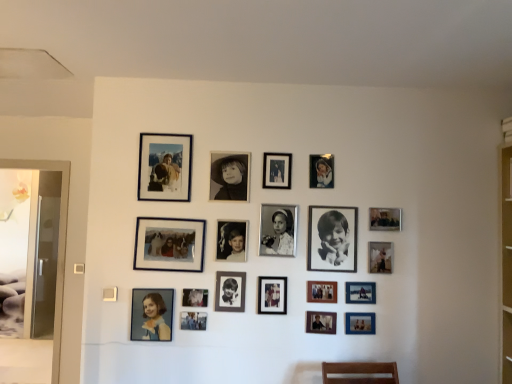
Locate an element on the screen. This screenshot has height=384, width=512. metallic silver photo frame at lower center, which appears as the fourth picture frame when viewed from the left is located at coordinates (193, 320).

In order to click on matte black photo frame at center, which appears as the 16th picture frame when viewed from the right in this screenshot , I will do `click(169, 244)`.

Image resolution: width=512 pixels, height=384 pixels. What do you see at coordinates (231, 241) in the screenshot?
I see `black glossy photo frame at center, which is counted as the eleventh picture frame, starting from the right` at bounding box center [231, 241].

Find the location of a particular element. Image resolution: width=512 pixels, height=384 pixels. black matte photo frame at center, the 6th picture frame viewed from the left is located at coordinates (229, 176).

The height and width of the screenshot is (384, 512). I want to click on matte silver photo frame at center, the fourteenth picture frame when ordered from right to left, so click(x=195, y=298).

Is matte black portrait at lower left, positioned as the first picture frame in left-to-right order, aimed at wooden photo frame at center, the 13th picture frame when ordered from left to right?

No.

Does matte black portrait at lower left, the eighteenth picture frame in the right-to-left sequence, lie in front of wooden photo frame at center, the 13th picture frame when ordered from left to right?

Yes, matte black portrait at lower left, the eighteenth picture frame in the right-to-left sequence, is in front of wooden photo frame at center, the 13th picture frame when ordered from left to right.

Which is more to the left, matte black portrait at lower left, the eighteenth picture frame in the right-to-left sequence, or wooden photo frame at center, the 13th picture frame when ordered from left to right?

matte black portrait at lower left, the eighteenth picture frame in the right-to-left sequence, is more to the left.

Looking at this image, what's the angular difference between matte black portrait at lower left, positioned as the first picture frame in left-to-right order, and wooden photo frame at center, the sixth picture frame when ordered from right to left,'s facing directions?

They differ by 0.011 degrees in their facing directions.

Could you tell me if black glossy photo frame at center, which is counted as the eleventh picture frame, starting from the right, is turned towards metallic silver photo frame at lower center, which appears as the fourth picture frame when viewed from the left?

No, black glossy photo frame at center, which is counted as the eleventh picture frame, starting from the right, does not turn towards metallic silver photo frame at lower center, which appears as the fourth picture frame when viewed from the left.

From a real-world perspective, between black glossy photo frame at center, which is counted as the eleventh picture frame, starting from the right, and metallic silver photo frame at lower center, which appears as the fourth picture frame when viewed from the left, who is vertically lower?

In real-world perspective, metallic silver photo frame at lower center, which appears as the fourth picture frame when viewed from the left, is lower.

Considering the points (245, 222) and (190, 327), which point is behind, point (245, 222) or point (190, 327)?

Positioned behind is point (245, 222).

Is black glossy photo frame at center, the eighth picture frame in the left-to-right sequence, behind metallic silver photo frame at lower center, which appears as the fourth picture frame when viewed from the left?

Yes, the depth of black glossy photo frame at center, the eighth picture frame in the left-to-right sequence, is greater than that of metallic silver photo frame at lower center, which appears as the fourth picture frame when viewed from the left.

Between matte black photo frame at center, which appears as the 16th picture frame when viewed from the right, and matte black portrait at lower left, positioned as the first picture frame in left-to-right order, which one has smaller width?

Thinner between the two is matte black portrait at lower left, positioned as the first picture frame in left-to-right order.

Between matte black photo frame at center, which is the 3th picture frame in left-to-right order, and matte black portrait at lower left, positioned as the first picture frame in left-to-right order, which one appears on the left side from the viewer's perspective?

matte black portrait at lower left, positioned as the first picture frame in left-to-right order, is more to the left.

Does matte black photo frame at center, which is the 3th picture frame in left-to-right order, come in front of matte black portrait at lower left, the eighteenth picture frame in the right-to-left sequence?

That is False.

Consider the image. Considering the sizes of objects matte black photo frame at center, which appears as the 16th picture frame when viewed from the right, and matte black portrait at lower left, positioned as the first picture frame in left-to-right order, in the image provided, who is taller, matte black photo frame at center, which appears as the 16th picture frame when viewed from the right, or matte black portrait at lower left, positioned as the first picture frame in left-to-right order,?

matte black photo frame at center, which appears as the 16th picture frame when viewed from the right.

In the scene shown: Which is more to the left, black matte photo frame at center, marked as the 8th picture frame in a right-to-left arrangement, or black matte photo frame at center, which ranks as the 12th picture frame in right-to-left order?

Positioned to the left is black matte photo frame at center, which ranks as the 12th picture frame in right-to-left order.

Where is `the 4th picture frame counting from the left of the black matte photo frame at center, which is counted as the 11th picture frame, starting from the left`? This screenshot has height=384, width=512. the 4th picture frame counting from the left of the black matte photo frame at center, which is counted as the 11th picture frame, starting from the left is located at coordinates (230, 291).

Is black matte photo frame at center, marked as the 8th picture frame in a right-to-left arrangement, touching black matte photo frame at center, which ranks as the 12th picture frame in right-to-left order?

No, black matte photo frame at center, marked as the 8th picture frame in a right-to-left arrangement, is not making contact with black matte photo frame at center, which ranks as the 12th picture frame in right-to-left order.

Would you say black matte photo frame at center, marked as the 8th picture frame in a right-to-left arrangement, is outside black matte photo frame at center, which ranks as the 12th picture frame in right-to-left order?

Absolutely, black matte photo frame at center, marked as the 8th picture frame in a right-to-left arrangement, is external to black matte photo frame at center, which ranks as the 12th picture frame in right-to-left order.

From a real-world perspective, is matte black photo frame at upper left, the 17th picture frame when ordered from right to left, positioned over metallic silver photo frame at upper right, marked as the fifth picture frame in a right-to-left arrangement, based on gravity?

No, from a real-world perspective, matte black photo frame at upper left, the 17th picture frame when ordered from right to left, is not on top of metallic silver photo frame at upper right, marked as the fifth picture frame in a right-to-left arrangement.

Between matte black photo frame at upper left, which is the second picture frame from left to right, and metallic silver photo frame at upper right, the fourteenth picture frame viewed from the left, which one appears on the right side from the viewer's perspective?

metallic silver photo frame at upper right, the fourteenth picture frame viewed from the left, is more to the right.

Is matte black photo frame at upper left, which is the second picture frame from left to right, positioned behind metallic silver photo frame at upper right, marked as the fifth picture frame in a right-to-left arrangement?

No, it is not.

Is metallic silver photo frame at upper right, marked as the fifth picture frame in a right-to-left arrangement, completely or partially outside of matte blue photo frame at lower right, positioned as the sixteenth picture frame in left-to-right order?

Yes, metallic silver photo frame at upper right, marked as the fifth picture frame in a right-to-left arrangement, is not within matte blue photo frame at lower right, positioned as the sixteenth picture frame in left-to-right order.

Is metallic silver photo frame at upper right, marked as the fifth picture frame in a right-to-left arrangement, to the left of matte blue photo frame at lower right, positioned as the sixteenth picture frame in left-to-right order, from the viewer's perspective?

Indeed, metallic silver photo frame at upper right, marked as the fifth picture frame in a right-to-left arrangement, is positioned on the left side of matte blue photo frame at lower right, positioned as the sixteenth picture frame in left-to-right order.

Which object is closer to the camera, metallic silver photo frame at upper right, the fourteenth picture frame viewed from the left, or matte blue photo frame at lower right, positioned as the 3th picture frame in right-to-left order?

matte blue photo frame at lower right, positioned as the 3th picture frame in right-to-left order, is closer to the camera.

From the image's perspective, is metallic silver photo frame at upper right, the fourteenth picture frame viewed from the left, below matte blue photo frame at lower right, positioned as the sixteenth picture frame in left-to-right order?

No, from the image's perspective, metallic silver photo frame at upper right, the fourteenth picture frame viewed from the left, is not beneath matte blue photo frame at lower right, positioned as the sixteenth picture frame in left-to-right order.

Is matte black photo frame at center, placed as the 10th picture frame when sorted from right to left, aimed at metallic silver photo frame at upper right, marked as the fifth picture frame in a right-to-left arrangement?

No, matte black photo frame at center, placed as the 10th picture frame when sorted from right to left, is not facing towards metallic silver photo frame at upper right, marked as the fifth picture frame in a right-to-left arrangement.

Considering the points (284, 311) and (322, 166), which point is in front, point (284, 311) or point (322, 166)?

The point (284, 311) is closer to the camera.

From the picture: Would you say matte black photo frame at center, placed as the 10th picture frame when sorted from right to left, contains metallic silver photo frame at upper right, the fourteenth picture frame viewed from the left?

No, metallic silver photo frame at upper right, the fourteenth picture frame viewed from the left, is not inside matte black photo frame at center, placed as the 10th picture frame when sorted from right to left.

From the picture: Is matte black photo frame at center, the 9th picture frame in the left-to-right sequence, with metallic silver photo frame at upper right, marked as the fifth picture frame in a right-to-left arrangement?

There is a gap between matte black photo frame at center, the 9th picture frame in the left-to-right sequence, and metallic silver photo frame at upper right, marked as the fifth picture frame in a right-to-left arrangement.

From the image's perspective, count 4th picture frames downward from the wooden photo frame at center, the 13th picture frame when ordered from left to right, and point to it. Please provide its 2D coordinates.

[(152, 314)]

Identify the location of picture frame that is the 4th one when counting leftward from the black glossy photo frame at center, which is counted as the eleventh picture frame, starting from the right. point(193,320).

From the image, which object appears to be farther from black matte photo frame at center, marked as the thirteenth picture frame in a right-to-left arrangement, matte black photo frame at upper left, which is the second picture frame from left to right, or wooden photo frame at center, the sixth picture frame when ordered from right to left?

wooden photo frame at center, the sixth picture frame when ordered from right to left, is positioned further to the anchor black matte photo frame at center, marked as the thirteenth picture frame in a right-to-left arrangement.

When comparing their distances from black matte photo frame at center, which ranks as the 12th picture frame in right-to-left order, does black glossy photo frame at center, the eighth picture frame in the left-to-right sequence, or matte black photo frame at center, the 9th picture frame in the left-to-right sequence, seem further?

The object further to black matte photo frame at center, which ranks as the 12th picture frame in right-to-left order, is black glossy photo frame at center, the eighth picture frame in the left-to-right sequence.

Based on their spatial positions, is wooden photo frame at center, the 13th picture frame when ordered from left to right, or matte black photo frame at center, which is the 3th picture frame in left-to-right order, closer to black matte photo frame at center, the seventh picture frame from the left?

matte black photo frame at center, which is the 3th picture frame in left-to-right order.

Which object lies further to the anchor point metallic silver photo frame at center, the 9th picture frame in the right-to-left sequence, matte black portrait at lower left, positioned as the first picture frame in left-to-right order, or black matte photo frame at center, which is counted as the 11th picture frame, starting from the left?

matte black portrait at lower left, positioned as the first picture frame in left-to-right order, is further to metallic silver photo frame at center, the 9th picture frame in the right-to-left sequence.

Based on their spatial positions, is metallic silver photo frame at upper right, marked as the fifth picture frame in a right-to-left arrangement, or wooden photo frame at center, the 13th picture frame when ordered from left to right, closer to matte black photo frame at center, which is the 3th picture frame in left-to-right order?

wooden photo frame at center, the 13th picture frame when ordered from left to right, is positioned closer to the anchor matte black photo frame at center, which is the 3th picture frame in left-to-right order.

Based on their spatial positions, is black matte photo frame at center, marked as the thirteenth picture frame in a right-to-left arrangement, or matte silver photo frame at center, the 5th picture frame when ordered from left to right, further from metallic silver photo frame at center, the 9th picture frame in the right-to-left sequence?

matte silver photo frame at center, the 5th picture frame when ordered from left to right, is further to metallic silver photo frame at center, the 9th picture frame in the right-to-left sequence.

When comparing their distances from matte black photo frame at upper left, the 17th picture frame when ordered from right to left, does wooden photo frame at center, the sixth picture frame when ordered from right to left, or matte black photo frame at center, which appears as the 16th picture frame when viewed from the right, seem closer?

Based on the image, matte black photo frame at center, which appears as the 16th picture frame when viewed from the right, appears to be nearer to matte black photo frame at upper left, the 17th picture frame when ordered from right to left.

Which object lies nearer to the anchor point matte blue photo frame at lower right, positioned as the sixteenth picture frame in left-to-right order, metallic silver photo frame at upper right, the fourteenth picture frame viewed from the left, or matte silver photo frame at center, the fourteenth picture frame when ordered from right to left?

The object closer to matte blue photo frame at lower right, positioned as the sixteenth picture frame in left-to-right order, is metallic silver photo frame at upper right, the fourteenth picture frame viewed from the left.